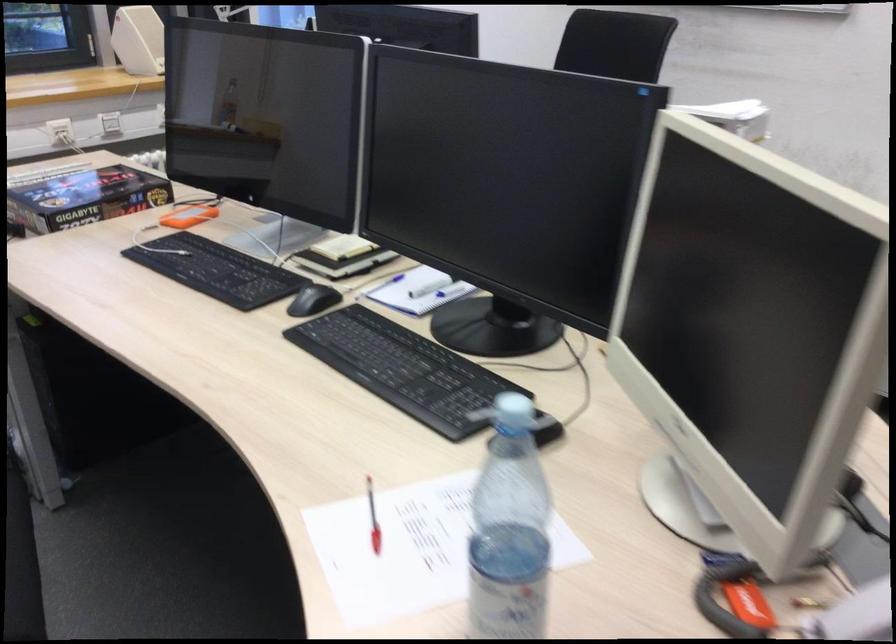
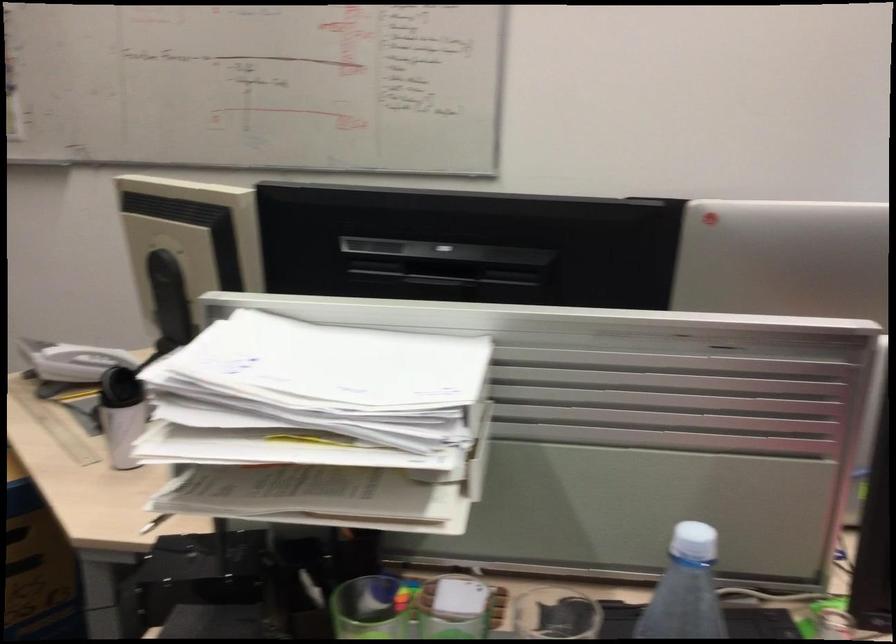
Question: I am providing you with two images of the same scene from different viewpoints. Please identify which objects are invisible in image2.

Choices:
 (A) black computer mouse
 (B) red sandal
 (C) plastic water bottle
 (D) white telephone handset

Answer: (A)